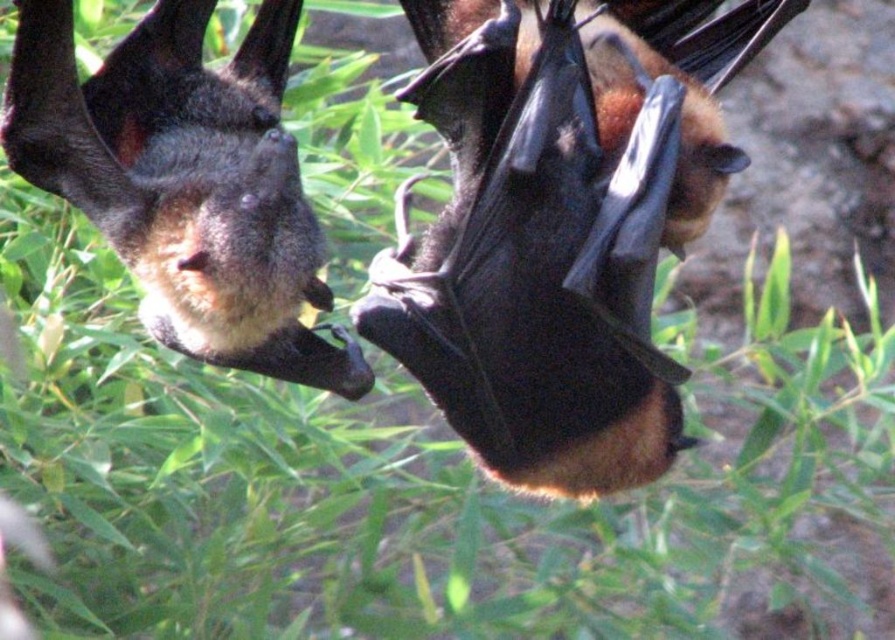
You are a wildlife photographer aiming to capture a closeup shot of the brown furry bat at center and the shiny brown bat at upper left. Given their positions and sizes, which bat would require you to use a longer focal length to fill the frame while maintaining focus on its facial features?

The brown furry bat at center is much taller than the shiny brown bat at upper left, so to fill the frame while focusing on its facial features, the photographer would need to use a longer focal length for the brown furry bat at center compared to the smaller shiny brown bat at upper left.

You are a wildlife photographer aiming to capture both bats in a single photo. Based on their positions, which bat should you focus on first to ensure the brown furry bat at center and the shiny brown bat at upper left are both in frame?

You should focus on the shiny brown bat at upper left first because the brown furry bat at center is to the right of it, so adjusting the camera to include the upper left bat ensures both are in frame.

You are standing in front of a tree where two bats are hanging upside down. You notice two points marked on the bats. The first point is at coordinates point [520,392] and the second is at point [163,164]. Which of these points is closer to you?

Point [520,392] is further to the camera than point [163,164], so the point closer to you is point [163,164].